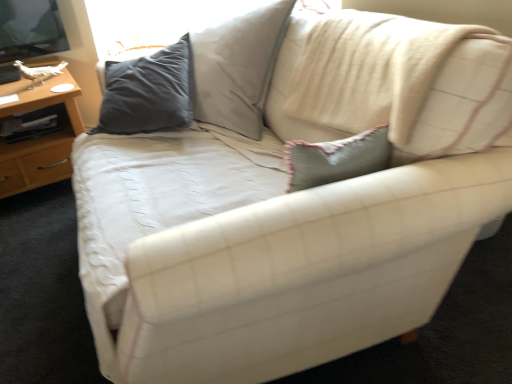
Question: From a real-world perspective, is light blue textured pillow at upper right located higher than wooden table at left?

Choices:
 (A) yes
 (B) no

Answer: (A)

Question: From the image's perspective, is light blue textured pillow at upper right on wooden table at left?

Choices:
 (A) yes
 (B) no

Answer: (A)

Question: From a real-world perspective, is light blue textured pillow at upper right located beneath wooden table at left?

Choices:
 (A) yes
 (B) no

Answer: (B)

Question: Is light blue textured pillow at upper right next to wooden table at left?

Choices:
 (A) yes
 (B) no

Answer: (B)

Question: Is light blue textured pillow at upper right bigger than wooden table at left?

Choices:
 (A) no
 (B) yes

Answer: (B)

Question: Is light blue textured pillow at upper right aimed at wooden table at left?

Choices:
 (A) yes
 (B) no

Answer: (B)

Question: Can you confirm if wooden table at left is bigger than light blue textured pillow at upper right?

Choices:
 (A) yes
 (B) no

Answer: (B)

Question: Is wooden table at left not within light blue textured pillow at upper right?

Choices:
 (A) yes
 (B) no

Answer: (A)

Question: Is wooden table at left positioned in front of light blue textured pillow at upper right?

Choices:
 (A) no
 (B) yes

Answer: (A)

Question: Is wooden table at left next to light blue textured pillow at upper right and touching it?

Choices:
 (A) no
 (B) yes

Answer: (A)

Question: Does wooden table at left have a greater height compared to light blue textured pillow at upper right?

Choices:
 (A) no
 (B) yes

Answer: (A)

Question: Are wooden table at left and light blue textured pillow at upper right far apart?

Choices:
 (A) no
 (B) yes

Answer: (B)

Question: Is wooden table at left in front of or behind light blue textured pillow at upper right in the image?

Choices:
 (A) behind
 (B) front

Answer: (A)